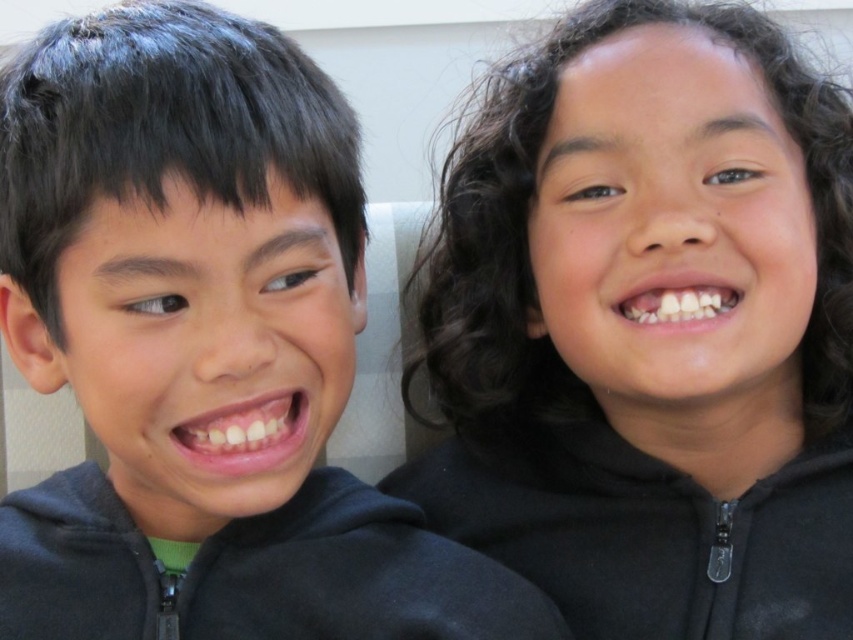
The image size is (853, 640). What do you see at coordinates (202, 349) in the screenshot?
I see `black matte hoodie at left` at bounding box center [202, 349].

Who is more forward, (224,115) or (517,250)?

Positioned in front is point (224,115).

Does point (3, 289) come behind point (519, 125)?

No, (3, 289) is closer to viewer.

I want to click on black matte hoodie at left, so click(x=202, y=349).

The image size is (853, 640). Describe the element at coordinates (640, 356) in the screenshot. I see `black matte hair at upper right` at that location.

Between black matte hair at upper right and black zip-up sweatshirt at lower left, which one is positioned higher?

black matte hair at upper right is higher up.

Who is more forward, (491, 259) or (387, 620)?

Point (387, 620) is more forward.

Identify the location of black matte hair at upper right. (640, 356).

Does black fleece sweatshirt at right come in front of black zip-up sweatshirt at lower left?

No, black fleece sweatshirt at right is further to the viewer.

Which is in front, point (657, 564) or point (10, 541)?

Point (10, 541) is in front.

The width and height of the screenshot is (853, 640). In order to click on black fleece sweatshirt at right in this screenshot , I will do `click(645, 531)`.

Find the location of a particular element. black fleece sweatshirt at right is located at coordinates (645, 531).